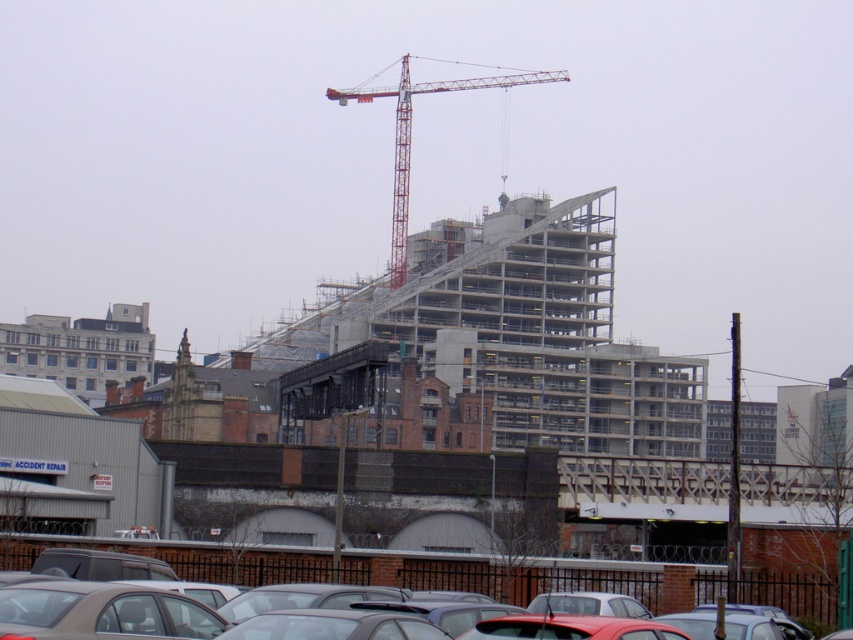
You are a delivery driver who needs to park your matte gray car at lower center in a spot that is exactly 60 feet away from the camera. Can you park your car in the designated spot without moving any other vehicles?

The matte gray car at lower center is currently 64.31 feet away from the camera, which is 4.31 feet further than the required 60 feet. Therefore, you would need to move the matte gray car at lower center closer by approximately 4.31 feet to park it in the designated spot. However, since the question specifies not moving other vehicles, and the current distance is already beyond the required 60 feet, it might not be possible without adjusting the car itself.

You are a delivery driver who needs to park your truck in the parking lot. The truck requires a space that is at least 20 meters long. Can you fit your truck between the matte gray sedan at center and the shiny red car at center?

The distance between the matte gray sedan at center and the shiny red car at center is 22.39 meters, which is longer than the required 20 meters. Therefore, the truck can fit between them.

You are a delivery driver who needs to park your truck in the parking lot near the construction site. You see the red metal crane at upper center and the matte gray car at lower center. Which object is bigger and might block your path if you try to park?

The red metal crane at upper center is larger than the matte gray car at lower center, so it might block your path if you try to park.